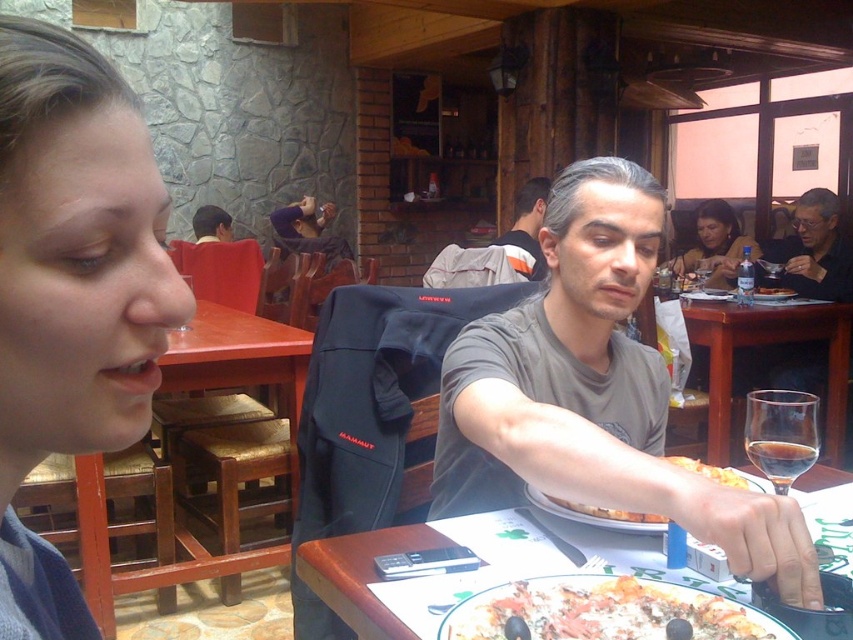
Question: Can you confirm if gray cotton shirt at center is bigger than golden crispy pizza at lower center?

Choices:
 (A) yes
 (B) no

Answer: (A)

Question: Which of these objects is positioned closest to the white glossy plate at center?

Choices:
 (A) gray cotton shirt at center
 (B) matte black jacket at upper right
 (C) transparent glass at center

Answer: (A)

Question: Does gray cotton shirt at center have a greater width compared to transparent glass at right?

Choices:
 (A) yes
 (B) no

Answer: (A)

Question: Does cheesy pizza at lower center have a smaller size compared to reddish-brown leather jacket at upper left?

Choices:
 (A) no
 (B) yes

Answer: (B)

Question: Which of the following is the closest to the observer?

Choices:
 (A) white glossy plate at center
 (B) gray matte t-shirt at center

Answer: (B)

Question: Which is nearer to the matte black jacket at upper right?

Choices:
 (A) white glossy plate at center
 (B) cheesy pizza at lower center
 (C) gray matte t-shirt at center

Answer: (C)